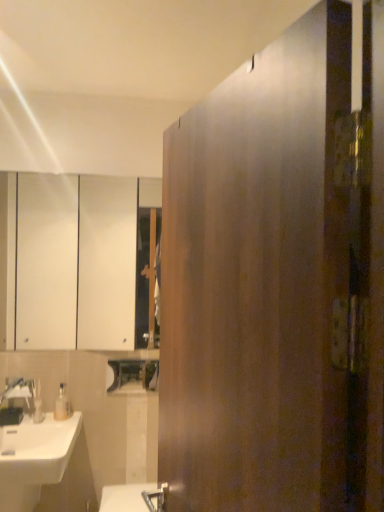
Locate an element on the screen. vacant region under white glossy cabinet at upper left (from a real-world perspective) is located at coordinates (71, 352).